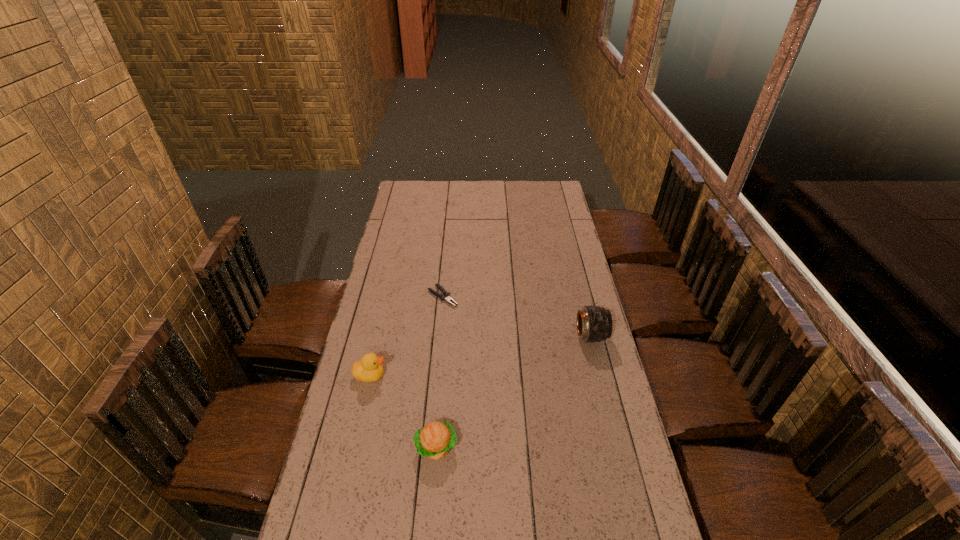
Identify the location of free spot between the farthest object and the duckling. Image resolution: width=960 pixels, height=540 pixels. (406, 336).

You are a GUI agent. You are given a task and a screenshot of the screen. Output one action in this format:
    pyautogui.click(x=<x>, y=<y>)
    Task: Click on the free space between the nearest object and the tallest object
    This screenshot has width=960, height=540.
    Given the screenshot: What is the action you would take?
    pyautogui.click(x=514, y=392)

The image size is (960, 540). Find the location of `vacant space that is in between the nearest object and the farthest object`. vacant space that is in between the nearest object and the farthest object is located at coordinates (440, 372).

This screenshot has width=960, height=540. Identify the location of empty location between the nearest object and the leftmost object. (403, 411).

You are a GUI agent. You are given a task and a screenshot of the screen. Output one action in this format:
    pyautogui.click(x=<x>, y=<y>)
    Task: Click on the free space between the shortest object and the hamburger
    The width and height of the screenshot is (960, 540).
    Given the screenshot: What is the action you would take?
    pyautogui.click(x=440, y=372)

Find the location of `vacant area that lies between the tallest object and the pliers`. vacant area that lies between the tallest object and the pliers is located at coordinates (516, 316).

I want to click on vacant region between the tallest object and the farthest object, so click(x=516, y=316).

Where is `free spot between the nearest object and the pliers`? Image resolution: width=960 pixels, height=540 pixels. free spot between the nearest object and the pliers is located at coordinates (440, 372).

Locate an element on the screen. free space between the third farthest object and the farthest object is located at coordinates (406, 336).

Locate which object ranks in proximity to the hamburger. Please provide its 2D coordinates. Your answer should be formatted as a tuple, i.e. [(x, y)], where the tuple contains the x and y coordinates of a point satisfying the conditions above.

[(369, 369)]